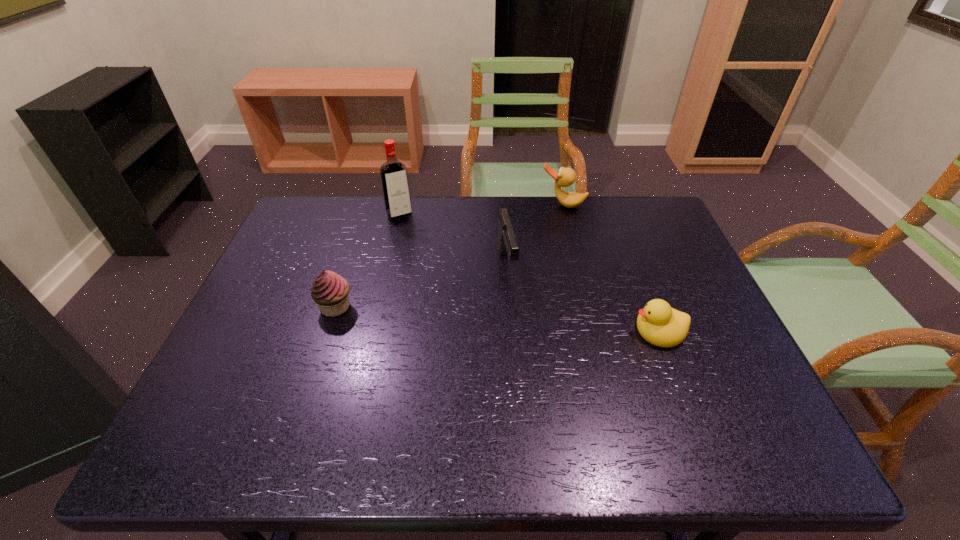
The width and height of the screenshot is (960, 540). Identify the location of free space on the desktop that is between the cupcake and the shortest object and is positioned on the front and back of the tallest object. (460, 316).

Find the location of a particular element. Image resolution: width=960 pixels, height=540 pixels. vacant space on the desktop that is between the leftmost object and the shortest object and is positioned on the beak of the duck is located at coordinates (525, 321).

The height and width of the screenshot is (540, 960). Find the location of `free spot on the desktop that is between the leftmost object and the duckling and is positioned aim along the barrel of the third nearest object`. free spot on the desktop that is between the leftmost object and the duckling and is positioned aim along the barrel of the third nearest object is located at coordinates (521, 320).